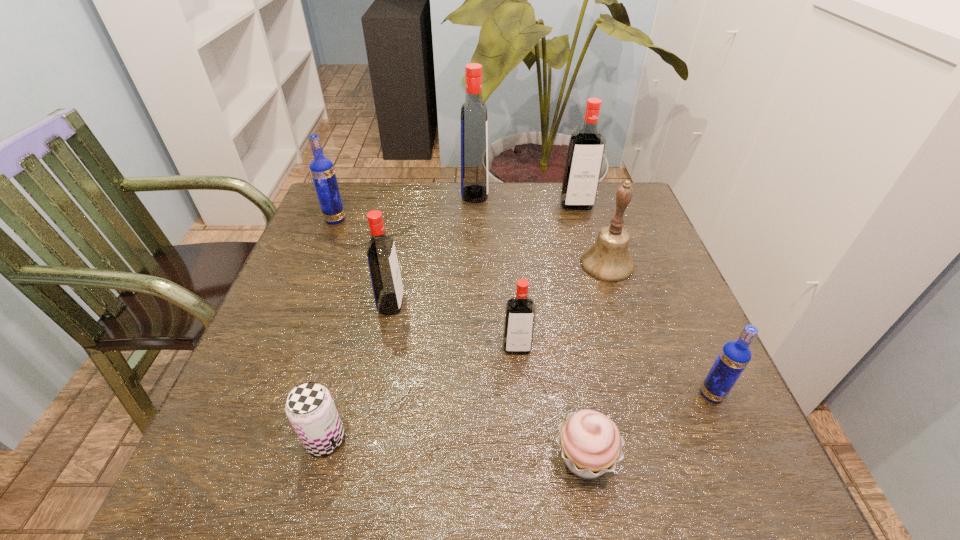
At what (x,y) coordinates should I click in order to perform the action: click on free space that satisfies the following two spatial constraints: 1. on the front and back of the second red vodka from right to left; 2. on the left side of the nearest vodka. Please return your answer as a coordinate pair (x, y). The width and height of the screenshot is (960, 540). Looking at the image, I should click on (520, 394).

You are a GUI agent. You are given a task and a screenshot of the screen. Output one action in this format:
    pyautogui.click(x=<x>, y=<y>)
    Task: Click on the free location that satisfies the following two spatial constraints: 1. on the front and back of the nearer blue vodka; 2. on the left side of the third red vodka from right to left
    The image size is (960, 540).
    Given the screenshot: What is the action you would take?
    pyautogui.click(x=471, y=394)